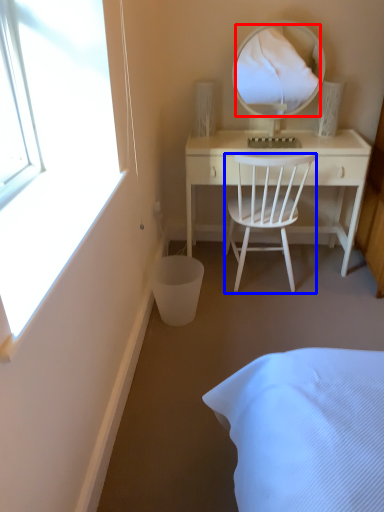
Question: Among these objects, which one is farthest to the camera, mirror (highlighted by a red box) or chair (highlighted by a blue box)?

Choices:
 (A) mirror
 (B) chair

Answer: (A)